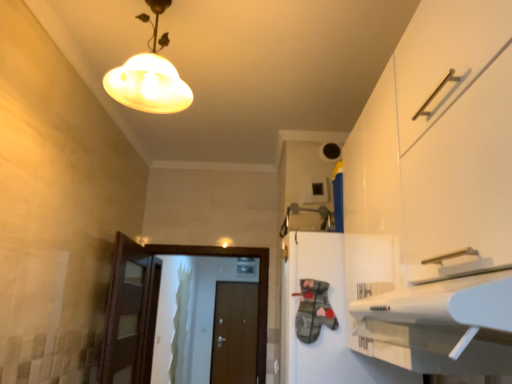
Question: Is matte glass lampshade at upper center thinner than brown matte door at center, arranged as the 2th door when viewed from the top?

Choices:
 (A) no
 (B) yes

Answer: (A)

Question: Can you confirm if matte glass lampshade at upper center is bigger than brown matte door at center, which is the second door in front-to-back order?

Choices:
 (A) yes
 (B) no

Answer: (B)

Question: Is matte glass lampshade at upper center oriented towards brown matte door at center, marked as the 1th door in a bottom-to-top arrangement?

Choices:
 (A) yes
 (B) no

Answer: (B)

Question: Does matte glass lampshade at upper center appear on the right side of brown matte door at center, which appears as the first door when viewed from the back?

Choices:
 (A) no
 (B) yes

Answer: (A)

Question: From the image's perspective, is matte glass lampshade at upper center on top of brown matte door at center, which appears as the first door when viewed from the back?

Choices:
 (A) yes
 (B) no

Answer: (A)

Question: Is matte glass lampshade at upper center positioned behind brown matte door at center, marked as the 1th door in a bottom-to-top arrangement?

Choices:
 (A) yes
 (B) no

Answer: (B)

Question: Considering the relative sizes of white matte cabinet at center and white glossy door at center, placed as the second door when sorted from bottom to top, in the image provided, is white matte cabinet at center bigger than white glossy door at center, placed as the second door when sorted from bottom to top,?

Choices:
 (A) yes
 (B) no

Answer: (A)

Question: Can you confirm if white matte cabinet at center is taller than white glossy door at center, the 2th door positioned from the back?

Choices:
 (A) no
 (B) yes

Answer: (A)

Question: From the image's perspective, is white matte cabinet at center beneath white glossy door at center, which ranks as the first door in top-to-bottom order?

Choices:
 (A) yes
 (B) no

Answer: (B)

Question: Is white matte cabinet at center beside white glossy door at center, the 2th door positioned from the back?

Choices:
 (A) yes
 (B) no

Answer: (B)

Question: Is white matte cabinet at center to the right of white glossy door at center, the 2th door positioned from the back, from the viewer's perspective?

Choices:
 (A) no
 (B) yes

Answer: (B)

Question: From a real-world perspective, is white matte cabinet at center located higher than white glossy door at center, placed as the second door when sorted from bottom to top?

Choices:
 (A) no
 (B) yes

Answer: (B)

Question: Does matte glass lampshade at upper center have a greater width compared to white glossy door at center, placed as the 1th door when sorted from front to back?

Choices:
 (A) yes
 (B) no

Answer: (A)